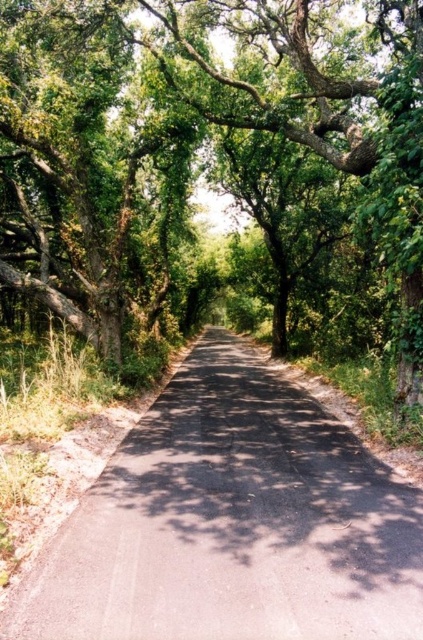
Can you confirm if green leafy tree at center is positioned above black asphalt road at center?

Yes.

Between green leafy tree at center and black asphalt road at center, which one appears on the left side from the viewer's perspective?

Positioned to the left is green leafy tree at center.

Does point (356, 154) come behind point (291, 499)?

Yes.

Where is `green leafy tree at center`? The image size is (423, 640). green leafy tree at center is located at coordinates (206, 148).